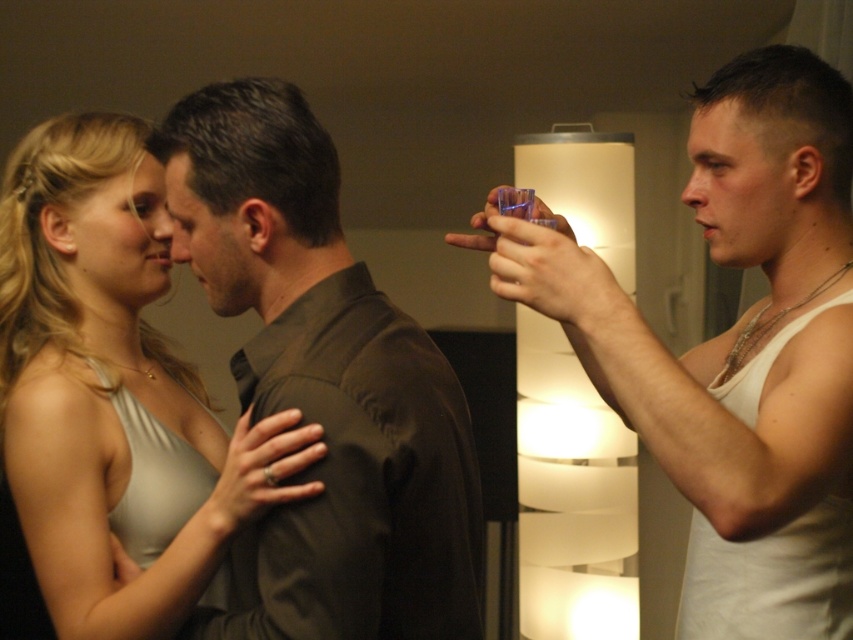
Question: Does translucent plastic cup at right appear over matte brown shirt at center?

Choices:
 (A) no
 (B) yes

Answer: (B)

Question: Based on their relative distances, which object is farther from the matte brown shirt at center?

Choices:
 (A) translucent plastic cup at right
 (B) matte silver dress at center

Answer: (A)

Question: Which object appears closest to the camera in this image?

Choices:
 (A) translucent plastic cup at right
 (B) matte silver dress at center

Answer: (A)

Question: Which of these objects is positioned closest to the matte brown shirt at center?

Choices:
 (A) translucent plastic cup at right
 (B) matte silver dress at center

Answer: (B)

Question: From the image, what is the correct spatial relationship of translucent plastic cup at right in relation to matte brown shirt at center?

Choices:
 (A) above
 (B) below

Answer: (A)

Question: Observing the image, what is the correct spatial positioning of matte brown shirt at center in reference to matte silver dress at center?

Choices:
 (A) below
 (B) above

Answer: (A)